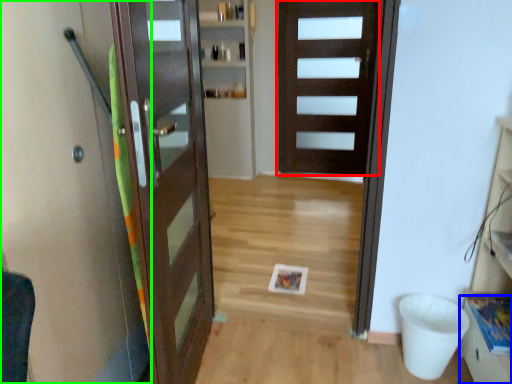
Question: Considering the real-world distances, which object is closest to door (highlighted by a red box)? drawer (highlighted by a blue box) or elevator (highlighted by a green box).

Choices:
 (A) drawer
 (B) elevator

Answer: (A)